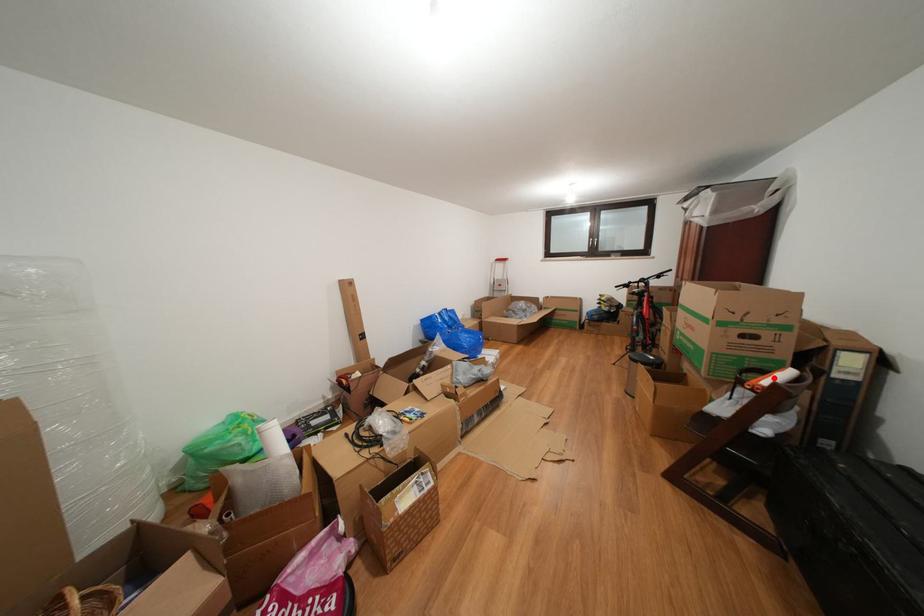
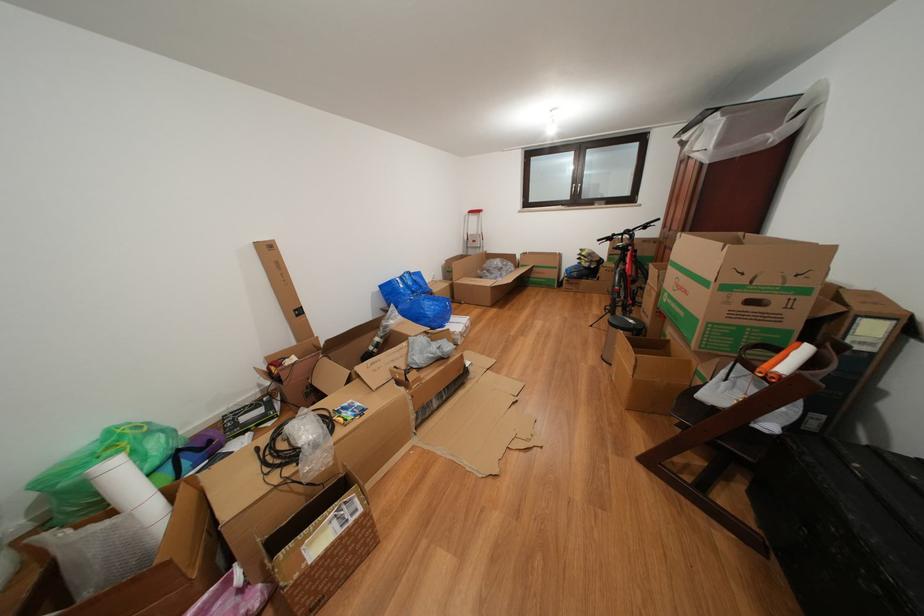
The point at the highlighted location is marked in the first image. Where is the corresponding point in the second image?

(784, 355)